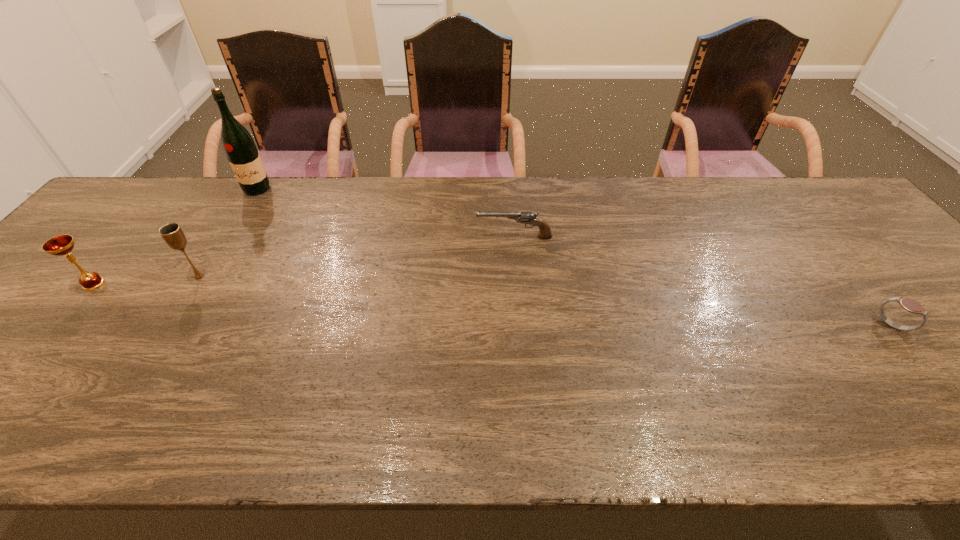
At what (x,y) coordinates should I click in order to perform the action: click on empty space that is in between the fourth tallest object and the right chalice. Please return your answer as a coordinate pair (x, y). Image resolution: width=960 pixels, height=540 pixels. Looking at the image, I should click on (357, 257).

Identify which object is the fourth nearest to the right chalice. Please provide its 2D coordinates. Your answer should be formatted as a tuple, i.e. [(x, y)], where the tuple contains the x and y coordinates of a point satisfying the conditions above.

[(910, 305)]

Find the location of `object that is the fourth closest to the tallest object`. object that is the fourth closest to the tallest object is located at coordinates (910, 305).